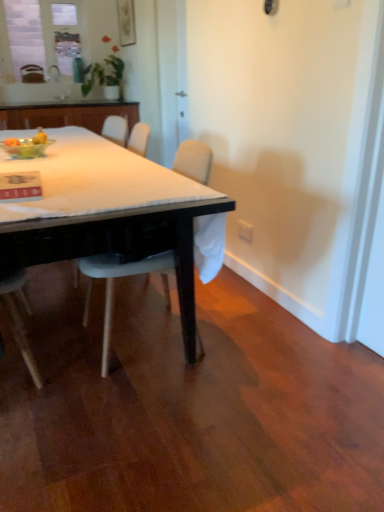
Question: In terms of height, does transparent glass bottle at upper center look taller or shorter compared to matte glass window at upper left?

Choices:
 (A) tall
 (B) short

Answer: (B)

Question: Would you say transparent glass bottle at upper center is to the left or to the right of matte glass window at upper left in the picture?

Choices:
 (A) left
 (B) right

Answer: (B)

Question: Estimate the real-world distances between objects in this image. Which object is closer to the white plastic power outlet at lower right?

Choices:
 (A) white glossy sink at upper center
 (B) matte wooden picture frame at upper center
 (C) wooden cabinet at upper left
 (D) translucent glass bowl at upper left
 (E) transparent glass bottle at upper center

Answer: (D)

Question: Which object is the closest to the matte wooden picture frame at upper center?

Choices:
 (A) white plastic chair at center, the first chair from the bottom
 (B) wooden cabinet at upper left
 (C) translucent glass bowl at upper left
 (D) matte black table at center
 (E) white glossy sink at upper center

Answer: (E)